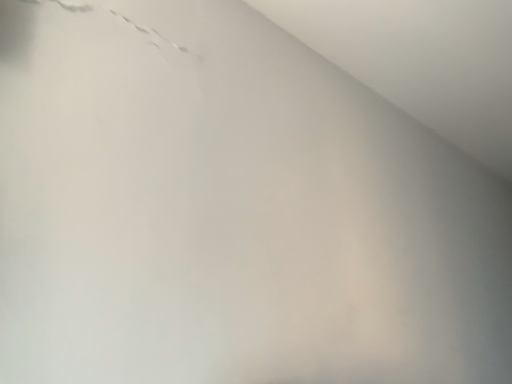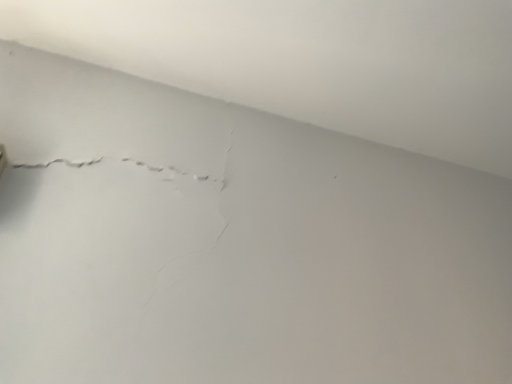
Question: Which way did the camera rotate in the video?

Choices:
 (A) rotated left
 (B) rotated right

Answer: (A)